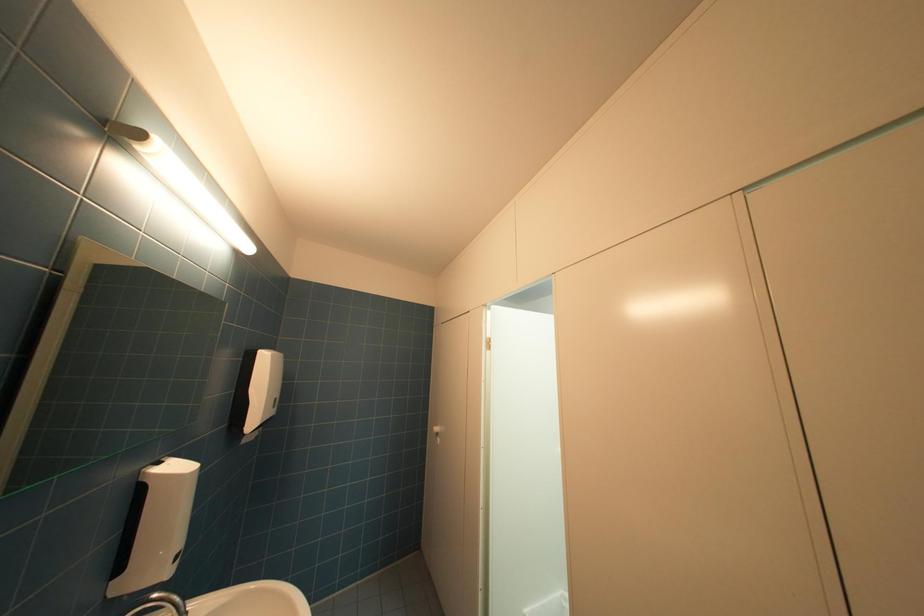
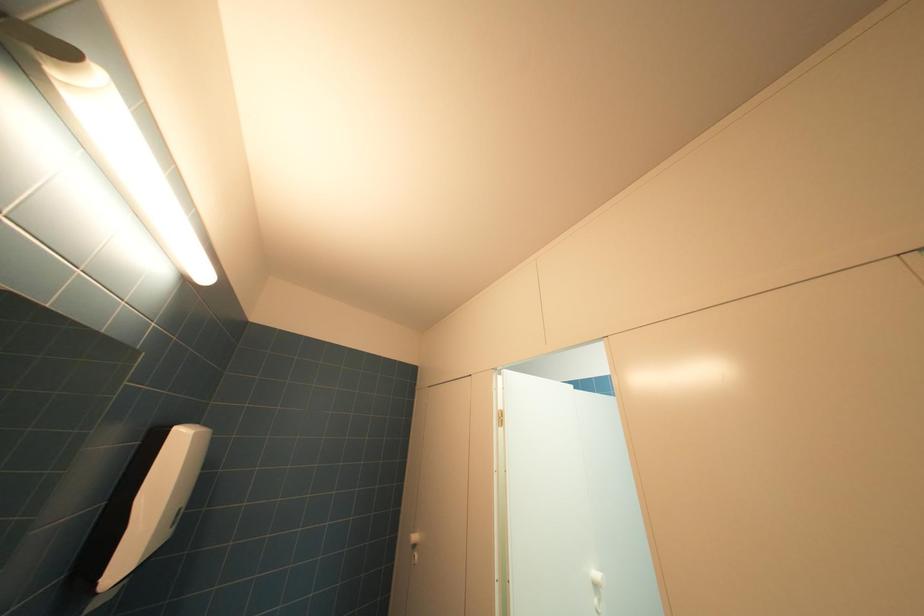
In a continuous first-person perspective shot, in which direction is the camera moving?

The cameraman moved toward left, forward.